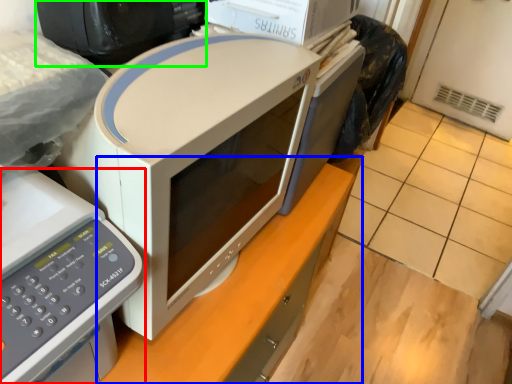
Question: Which object is the farthest from home appliance (highlighted by a red box)? Choose among these: computer desk (highlighted by a blue box) or desktop computer (highlighted by a green box).

Choices:
 (A) computer desk
 (B) desktop computer

Answer: (A)